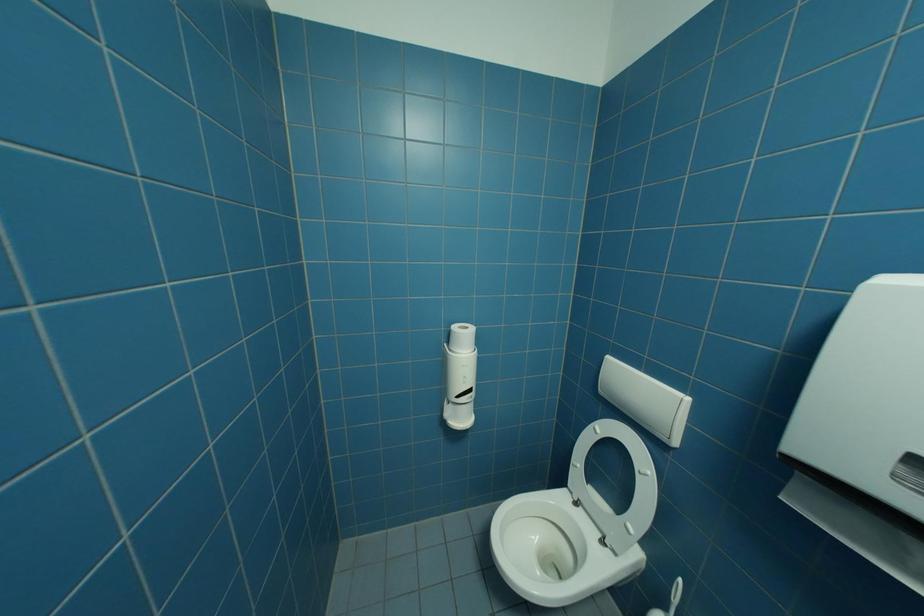
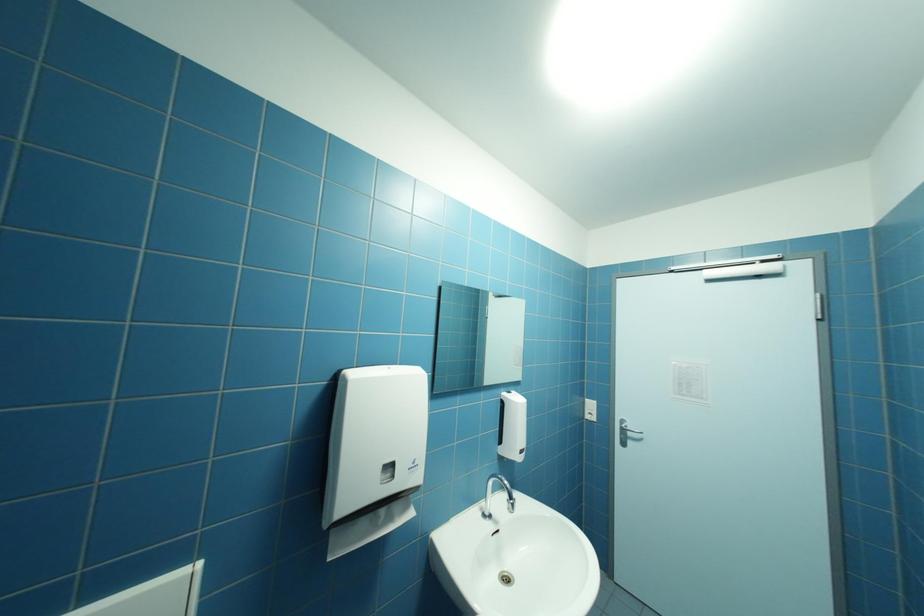
Question: The camera is either moving clockwise (left) or counter-clockwise (right) around the object. The first image is from the beginning of the video and the second image is from the end. Is the camera moving left or right when shooting the video?

Choices:
 (A) Left
 (B) Right

Answer: (A)